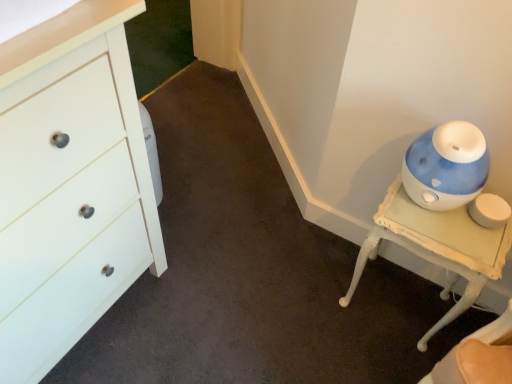
Image resolution: width=512 pixels, height=384 pixels. What are the coordinates of `free location in front of blue glossy humidifier at right` in the screenshot? It's located at (374, 357).